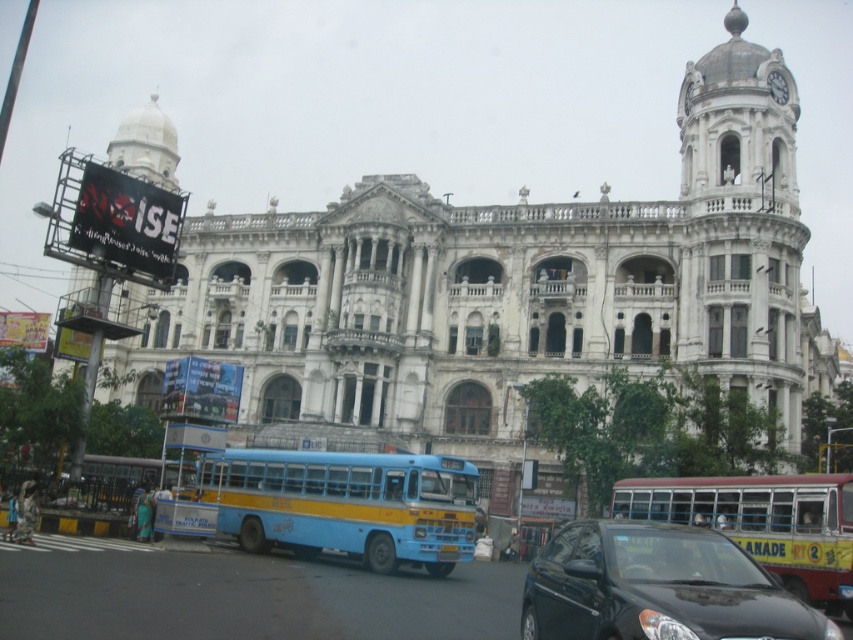
Does shiny black car at center have a larger size compared to blue/yellow painted bus at lower left?

Yes.

Can you confirm if shiny black car at center is taller than blue/yellow painted bus at lower left?

Correct, shiny black car at center is much taller as blue/yellow painted bus at lower left.

Which is in front, point (659, 602) or point (184, 497)?

Point (659, 602) is in front.

Find the location of a particular element. The image size is (853, 640). shiny black car at center is located at coordinates (657, 588).

Is blue matte bus at center closer to the viewer compared to yellow painted bus at center?

No, blue matte bus at center is further to the viewer.

Which of these two, blue matte bus at center or yellow painted bus at center, stands shorter?

With less height is blue matte bus at center.

Is point (344, 472) farther from viewer compared to point (817, 561)?

Yes, it is behind point (817, 561).

Find the location of a particular element. blue matte bus at center is located at coordinates (346, 504).

Which is above, yellow painted bus at center or blue/yellow painted bus at lower left?

blue/yellow painted bus at lower left is above.

What do you see at coordinates (763, 524) in the screenshot? The image size is (853, 640). I see `yellow painted bus at center` at bounding box center [763, 524].

Identify the location of yellow painted bus at center. (763, 524).